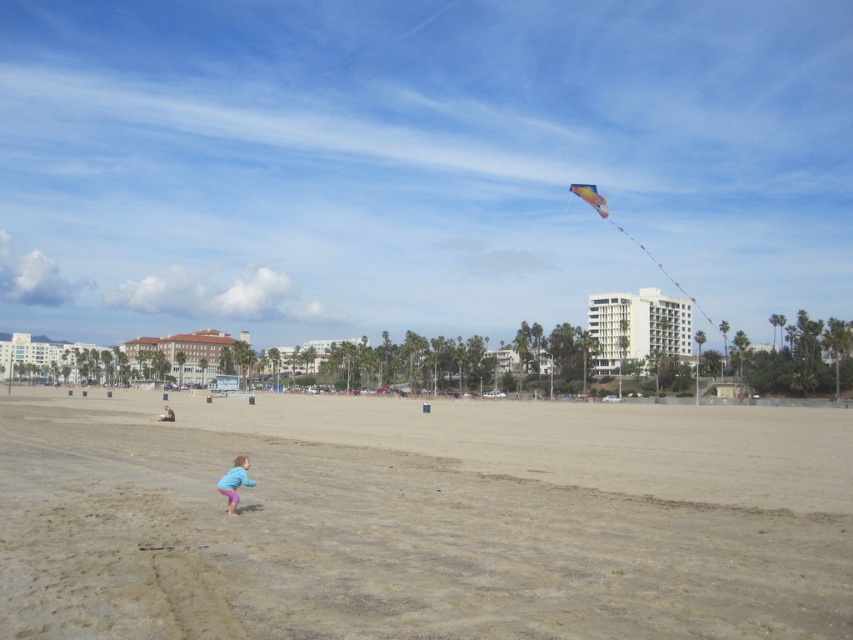
You are standing at the point closer to the viewer between the two points, point [611,353] and point [230,502]. If you look towards the horizon, which direction would you face? The beach stretches towards the horizon where palm trees and buildings are located.

Since point [611,353] is closer to the viewer than point [230,502], standing at point [611,353] you would face towards the midground where the palm trees and buildings are located on the horizon.

You are standing on the sandy beach and notice a multicolored fabric kite at upper right. Based on its position, can you estimate whether it is closer to the palm trees in the midground or the highrise hotel in the background?

The multicolored fabric kite at upper right is located at point (628,236), which places it closer to the palm trees in the midground than the highrise hotel in the background.

You are a photographer trying to capture the multicolored fabric kite at upper right and the pastel blue shorts at lower center in a single shot. Based on their positions, will the kite appear higher or lower in the photo compared to the shorts?

The multicolored fabric kite at upper right is located above the pastel blue shorts at lower center, so in the photo, the kite will appear higher than the shorts.